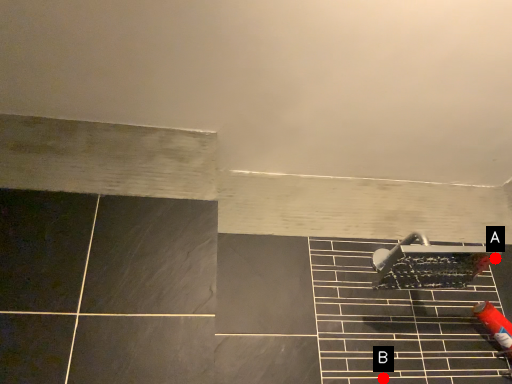
Question: Two points are circled on the image, labeled by A and B beside each circle. Which point is closer to the camera?

Choices:
 (A) A is closer
 (B) B is closer

Answer: (B)